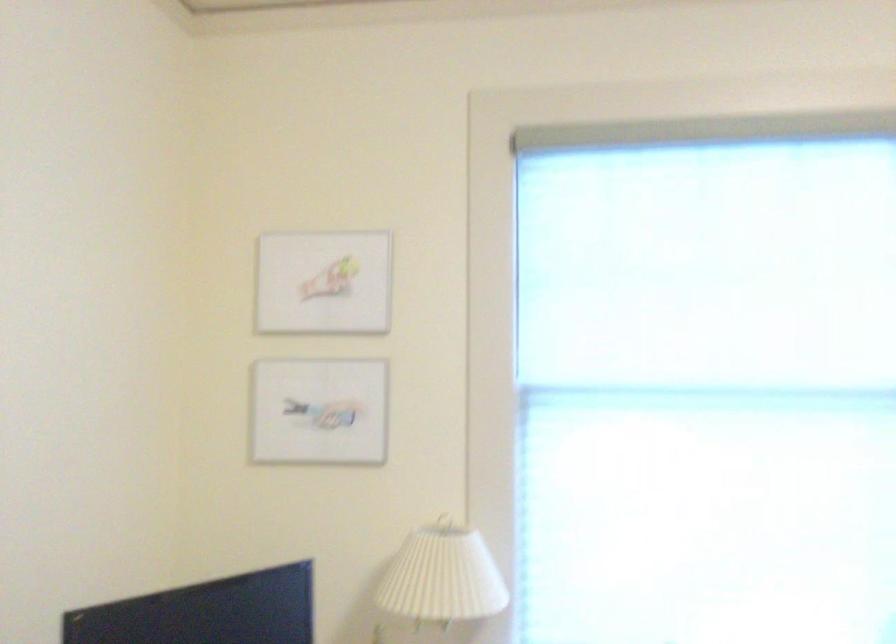
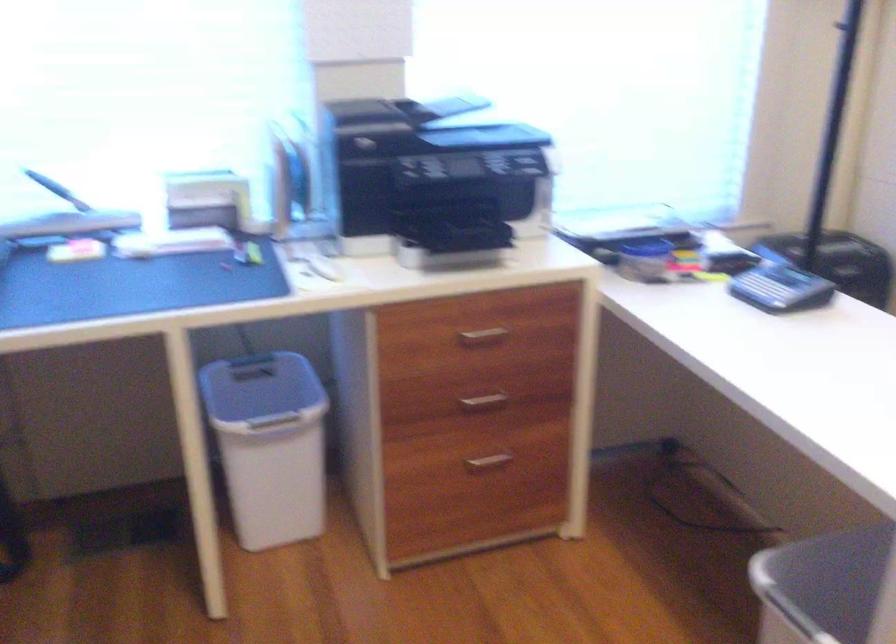
How did the camera likely rotate?

The rotation direction of the camera is right-down.